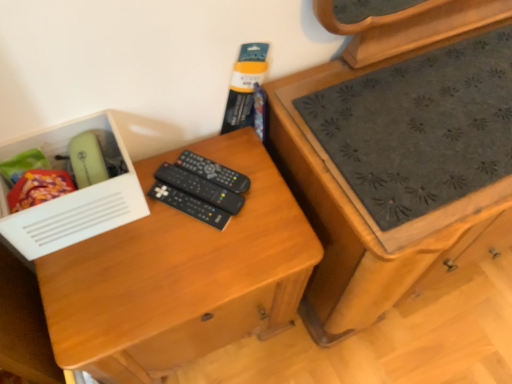
You are a GUI agent. You are given a task and a screenshot of the screen. Output one action in this format:
    pyautogui.click(x=<x>, y=<y>)
    Task: Click on the free spot behind black plastic remote controls at center, which is counted as the 1th remote control, starting from the top
    The image size is (512, 384).
    Given the screenshot: What is the action you would take?
    pyautogui.click(x=225, y=147)